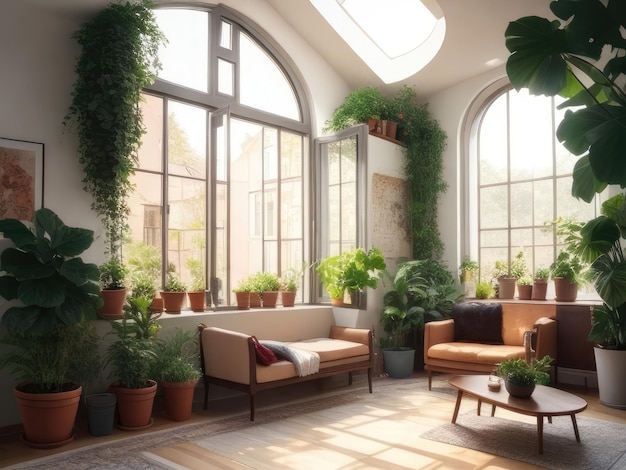
The height and width of the screenshot is (470, 626). What are the coordinates of `visible windows` in the screenshot? It's located at (265, 215), (187, 206), (173, 42), (277, 73), (228, 80), (225, 41), (561, 188).